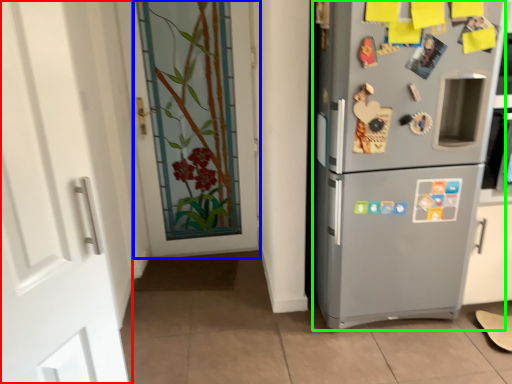
Question: Which object is the farthest from door (highlighted by a red box)? Choose among these: door (highlighted by a blue box) or refrigerator (highlighted by a green box).

Choices:
 (A) door
 (B) refrigerator

Answer: (A)